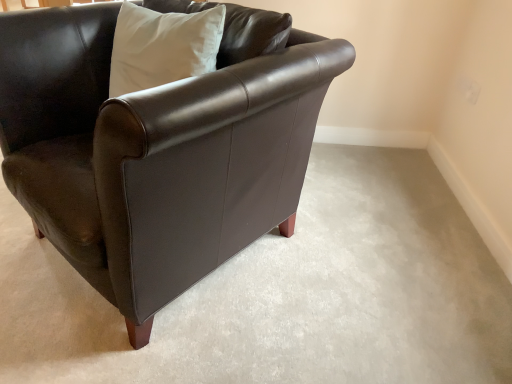
The width and height of the screenshot is (512, 384). In order to click on vacant space to the right of matte black leather chair at center in this screenshot , I will do `click(370, 258)`.